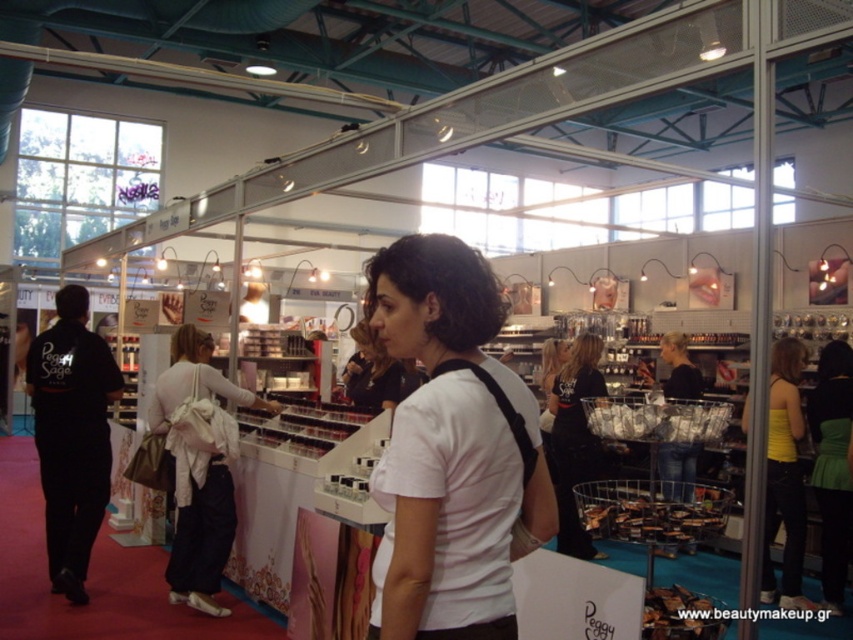
Question: Is black fabric jacket at left wider than matte white shirt at center?

Choices:
 (A) yes
 (B) no

Answer: (A)

Question: Is the position of white matte shirt at center less distant than that of white fabric bag at center?

Choices:
 (A) yes
 (B) no

Answer: (A)

Question: Which object is positioned closest to the matte white shirt at center?

Choices:
 (A) yellow fabric tank top at center
 (B) white matte shirt at center
 (C) green satin dress at lower right
 (D) black fabric jacket at left

Answer: (D)

Question: Is white matte shirt at center bigger than green satin dress at lower right?

Choices:
 (A) yes
 (B) no

Answer: (B)

Question: Which is nearer to the matte white shirt at center?

Choices:
 (A) yellow fabric tank top at center
 (B) black fabric pants at center
 (C) black fabric jacket at left
 (D) white fabric bag at center

Answer: (D)

Question: Which object is farther from the camera taking this photo?

Choices:
 (A) yellow fabric tank top at center
 (B) white matte shirt at center

Answer: (A)